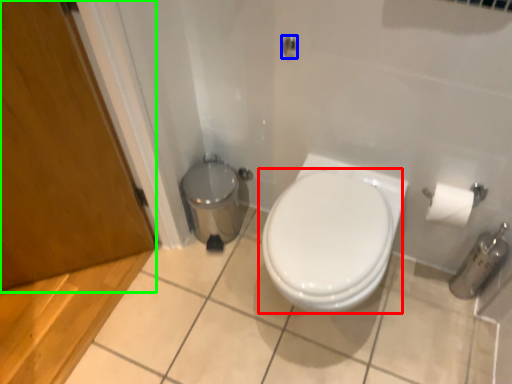
Question: Considering the real-world distances, which object is closest to toilet (highlighted by a red box)? shower (highlighted by a blue box) or screen door (highlighted by a green box).

Choices:
 (A) shower
 (B) screen door

Answer: (A)